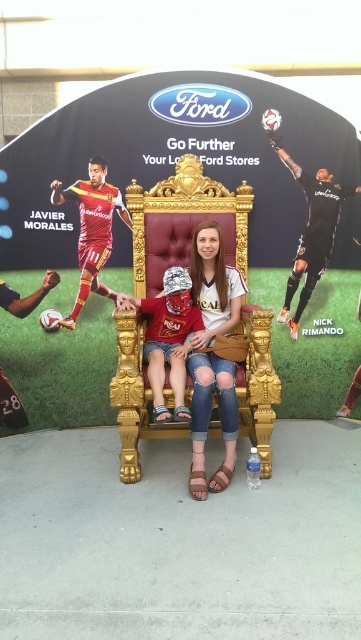
You are standing in front of the Ford promotional backdrop and notice a specific point marked at coordinates (179, 248). What object is located at that point?

The matte red jersey at upper left is located at point (179, 248).

Looking at the scene, where is the black jersey at upper right in relation to the matte red soccer jersey at left?

The black jersey at upper right is positioned to the right of the matte red soccer jersey at left.